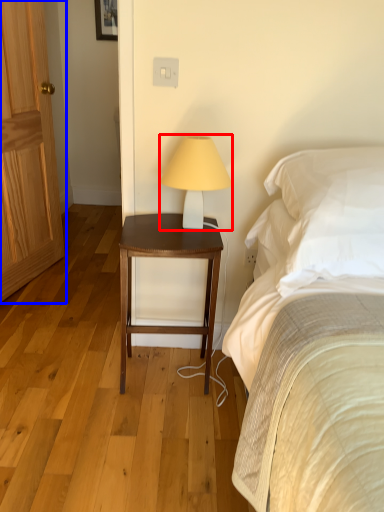
Question: Among these objects, which one is nearest to the camera, table lamp (highlighted by a red box) or door (highlighted by a blue box)?

Choices:
 (A) table lamp
 (B) door

Answer: (A)